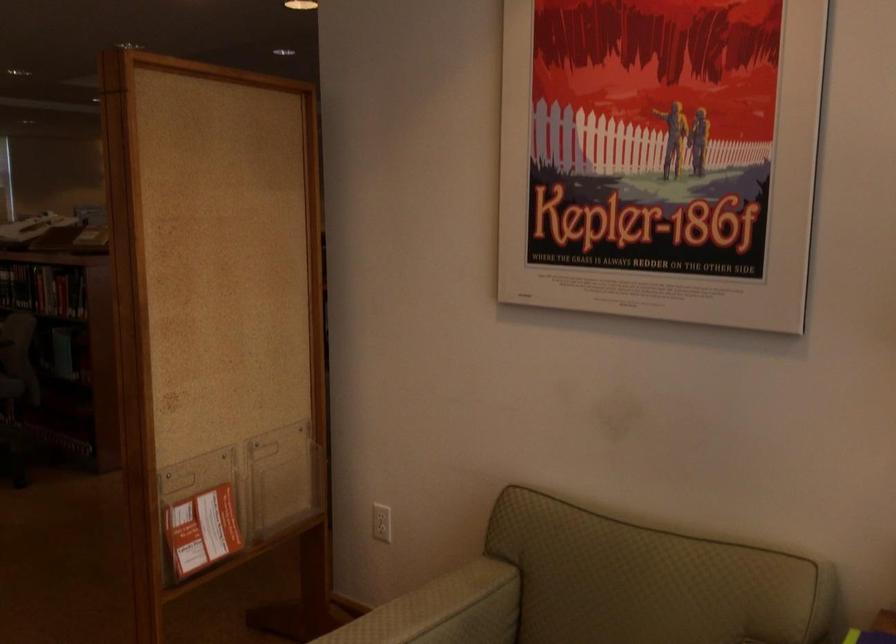
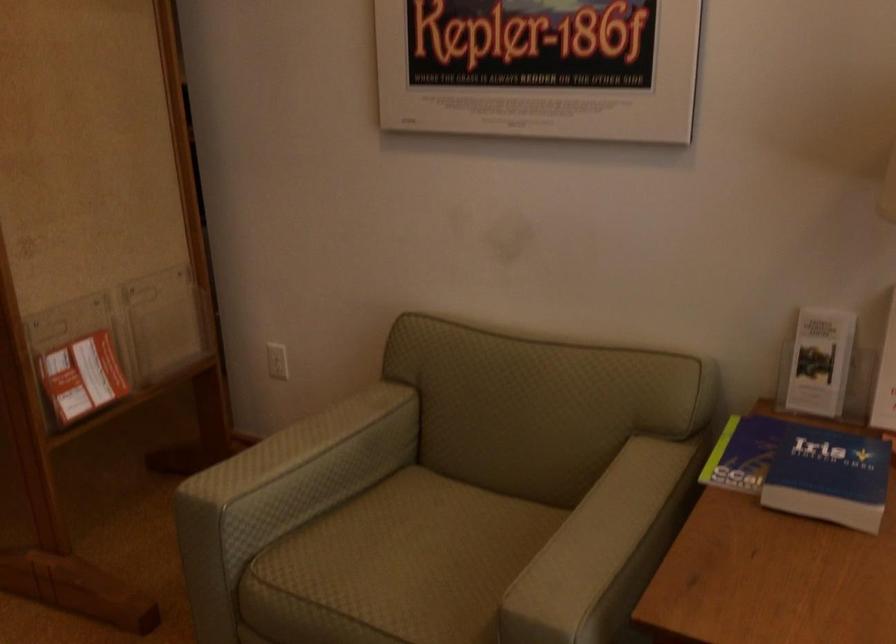
Locate, in the second image, the point that corresponds to pixel 204 524 in the first image.

(82, 377)